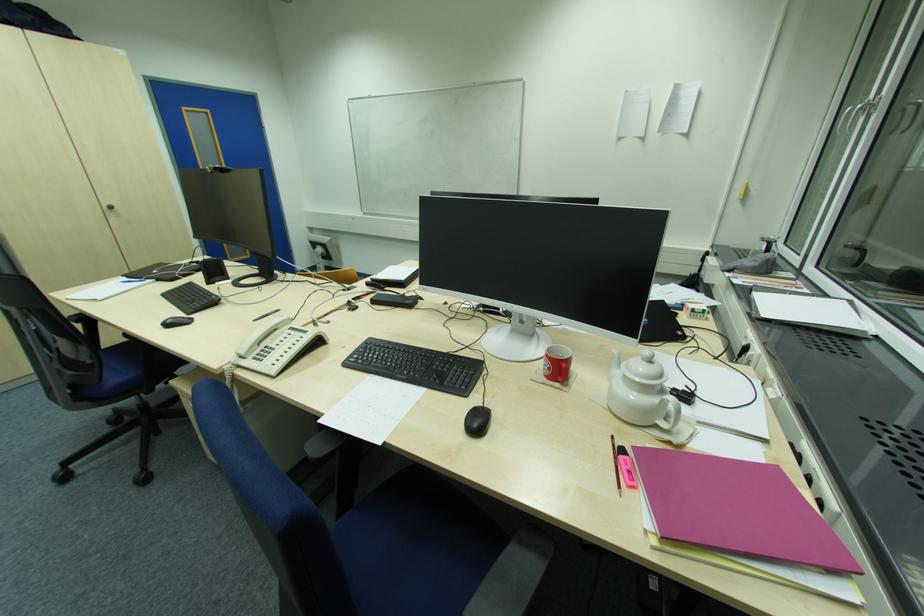
What are the coordinates of `pink highlighter cap` in the screenshot? It's located at (626, 469).